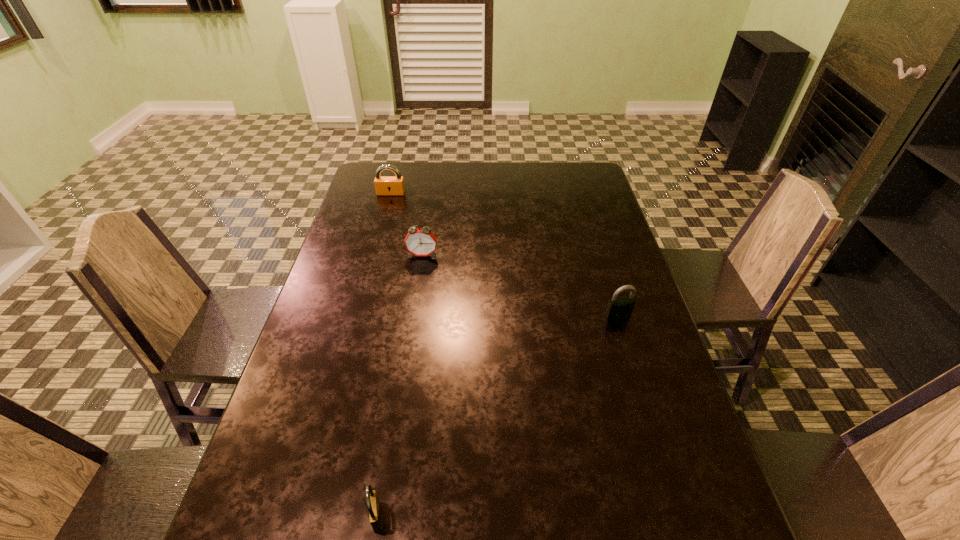
The image size is (960, 540). I want to click on vacant region located 0.350m on the right of the nearest padlock, so click(572, 517).

Locate an element on the screen. This screenshot has width=960, height=540. object that is positioned at the far edge is located at coordinates pos(384,185).

Find the location of a particular element. Image resolution: width=960 pixels, height=540 pixels. object at the left edge is located at coordinates (384, 185).

The image size is (960, 540). Find the location of `object situated at the right edge`. object situated at the right edge is located at coordinates (619, 308).

At what (x,y) coordinates should I click in order to perform the action: click on object present at the far left corner. Please return your answer as a coordinate pair (x, y). Looking at the image, I should click on (384, 185).

Where is `free region at the far edge of the desktop`? The width and height of the screenshot is (960, 540). free region at the far edge of the desktop is located at coordinates (475, 181).

At what (x,y) coordinates should I click in order to perform the action: click on vacant region at the left edge of the desktop. Please return your answer as a coordinate pair (x, y). The image size is (960, 540). Looking at the image, I should click on (308, 349).

The height and width of the screenshot is (540, 960). Find the location of `vacant area at the right edge`. vacant area at the right edge is located at coordinates (639, 354).

At what (x,y) coordinates should I click in order to perform the action: click on vacant space at the far left corner of the desktop. Please return your answer as a coordinate pair (x, y). The height and width of the screenshot is (540, 960). Looking at the image, I should click on (360, 190).

At what (x,y) coordinates should I click in order to perform the action: click on free area in between the nearest object and the second nearest object. Please return your answer as a coordinate pair (x, y). This screenshot has width=960, height=540. Looking at the image, I should click on (497, 416).